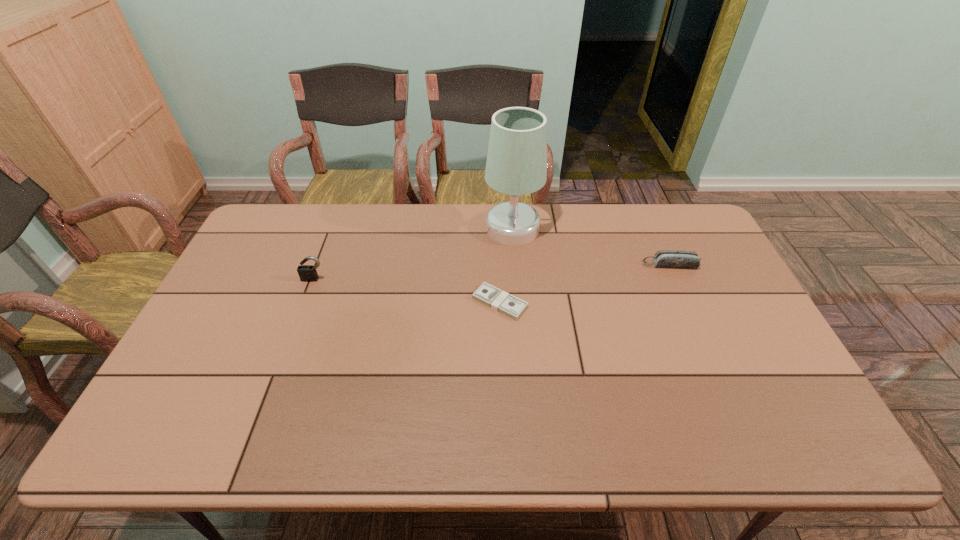
You are a GUI agent. You are given a task and a screenshot of the screen. Output one action in this format:
    pyautogui.click(x=<x>, y=<y>)
    Task: Click on the vacant space located 0.090m on the base of the farthest object
    
    Given the screenshot: What is the action you would take?
    pyautogui.click(x=459, y=228)

The image size is (960, 540). I want to click on free location located 0.210m with the keyhole on the front of the second tallest object, so click(x=293, y=336).

Where is `vacant area located on the left of the rightmost object`? The image size is (960, 540). vacant area located on the left of the rightmost object is located at coordinates (540, 265).

Find the location of `vacant point located 0.150m on the left of the shortest object`. vacant point located 0.150m on the left of the shortest object is located at coordinates (421, 302).

The height and width of the screenshot is (540, 960). Find the location of `object present at the far edge`. object present at the far edge is located at coordinates (516, 161).

Locate an element on the screen. object present at the right edge is located at coordinates (675, 259).

I want to click on free location at the far edge, so click(x=343, y=234).

Find the location of `free space at the near edge`. free space at the near edge is located at coordinates (435, 422).

The image size is (960, 540). I want to click on free location at the left edge of the desktop, so click(193, 388).

In the image, there is a desktop. Identify the location of vacant space at the right edge. (684, 270).